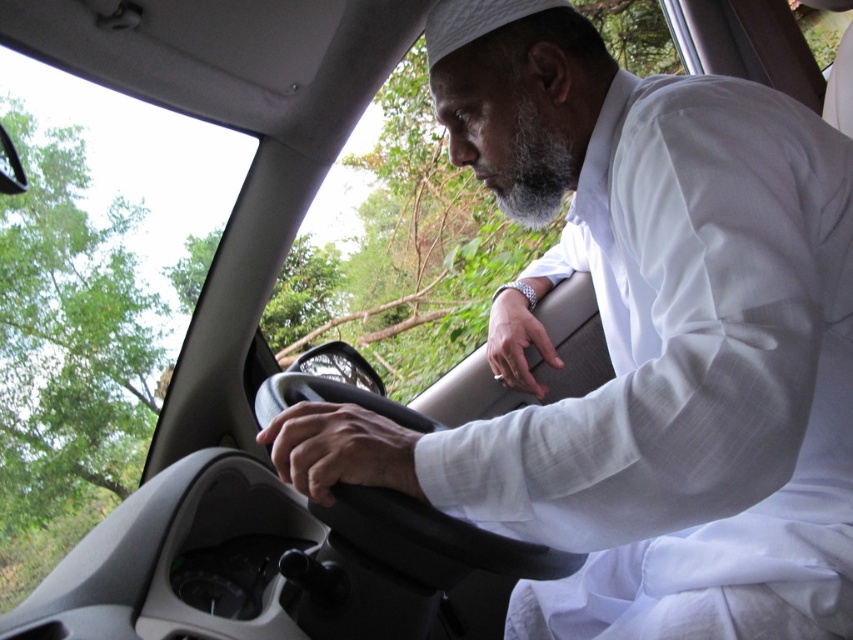
Is white silk robe at center above silver metallic wristwatch at center?

Incorrect, white silk robe at center is not positioned above silver metallic wristwatch at center.

From the picture: Which is above, white silk robe at center or silver metallic wristwatch at center?

Positioned higher is silver metallic wristwatch at center.

Find the location of a particular element. This screenshot has height=640, width=853. white silk robe at center is located at coordinates (689, 378).

At what (x,y) coordinates should I click in order to perform the action: click on white silk robe at center. Please return your answer as a coordinate pair (x, y). The image size is (853, 640). Looking at the image, I should click on (689, 378).

Can you confirm if white silk robe at center is positioned above smooth skin hand at center?

Yes.

Can you confirm if white silk robe at center is positioned to the right of smooth skin hand at center?

Correct, you'll find white silk robe at center to the right of smooth skin hand at center.

Is point (753, 291) positioned in front of point (299, 467)?

Yes, it is in front of point (299, 467).

You are a GUI agent. You are given a task and a screenshot of the screen. Output one action in this format:
    pyautogui.click(x=<x>, y=<y>)
    Task: Click on the white silk robe at center
    The image size is (853, 640).
    Given the screenshot: What is the action you would take?
    pyautogui.click(x=689, y=378)

Which is above, smooth skin hand at center or silver metallic wristwatch at center?

silver metallic wristwatch at center

Who is more forward, (403, 428) or (553, 349)?

Positioned in front is point (403, 428).

In order to click on smooth skin hand at center in this screenshot , I will do [x=340, y=449].